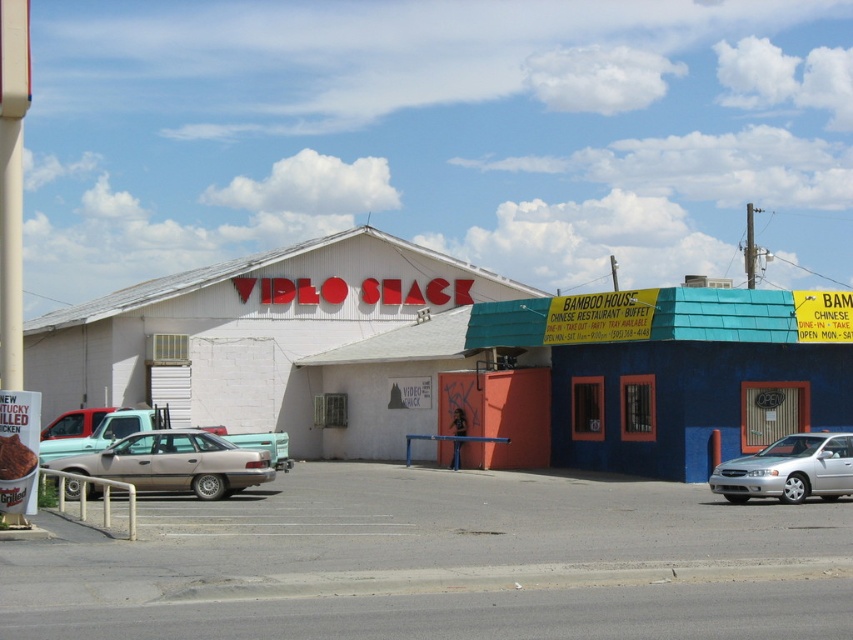
You are standing at the point marked by coordinates point (440,563) in the image. What is the surface material under your feet?

The surface material under your feet is gray asphalt parking lot at center, as the point (440,563) represents this location.